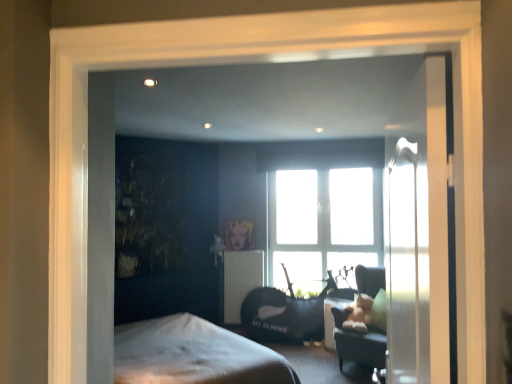
Question: Is matte black table at lower center facing towards clear glass door at right?

Choices:
 (A) no
 (B) yes

Answer: (A)

Question: Does matte black table at lower center lie behind clear glass door at right?

Choices:
 (A) yes
 (B) no

Answer: (A)

Question: Could clear glass door at right be considered to be inside matte black table at lower center?

Choices:
 (A) no
 (B) yes

Answer: (A)

Question: Are matte black table at lower center and clear glass door at right located far from each other?

Choices:
 (A) yes
 (B) no

Answer: (A)

Question: Does matte black table at lower center touch clear glass door at right?

Choices:
 (A) yes
 (B) no

Answer: (B)

Question: Is matte black table at lower center outside clear glass door at right?

Choices:
 (A) yes
 (B) no

Answer: (A)

Question: Does metallic gold picture frame at center have a larger size compared to matte black table at lower center?

Choices:
 (A) no
 (B) yes

Answer: (A)

Question: Is metallic gold picture frame at center looking in the opposite direction of matte black table at lower center?

Choices:
 (A) no
 (B) yes

Answer: (A)

Question: Is metallic gold picture frame at center not close to matte black table at lower center?

Choices:
 (A) yes
 (B) no

Answer: (A)

Question: From a real-world perspective, is metallic gold picture frame at center located beneath matte black table at lower center?

Choices:
 (A) no
 (B) yes

Answer: (A)

Question: Is matte black table at lower center inside metallic gold picture frame at center?

Choices:
 (A) no
 (B) yes

Answer: (A)

Question: Can you confirm if metallic gold picture frame at center is positioned to the left of matte black table at lower center?

Choices:
 (A) yes
 (B) no

Answer: (A)

Question: Can velvet dark gray swivel chair at center, which ranks as the first swivel chair in front-to-back order, be found inside velvet black swivel chair at center, acting as the 1th swivel chair starting from the back?

Choices:
 (A) yes
 (B) no

Answer: (B)